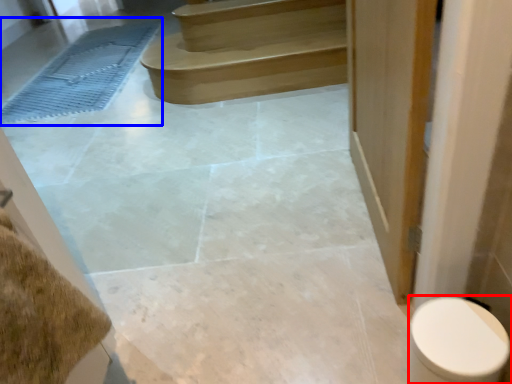
Question: Which object is further to the camera taking this photo, toilet (highlighted by a red box) or bath mat (highlighted by a blue box)?

Choices:
 (A) toilet
 (B) bath mat

Answer: (B)